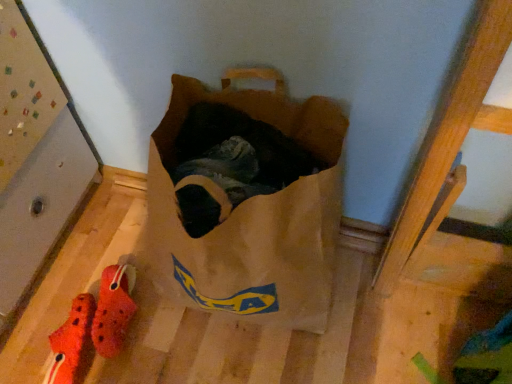
Identify the location of free space to the back side of orange fabric slipper at lower left, acting as the second footwear starting from the right. (79, 275).